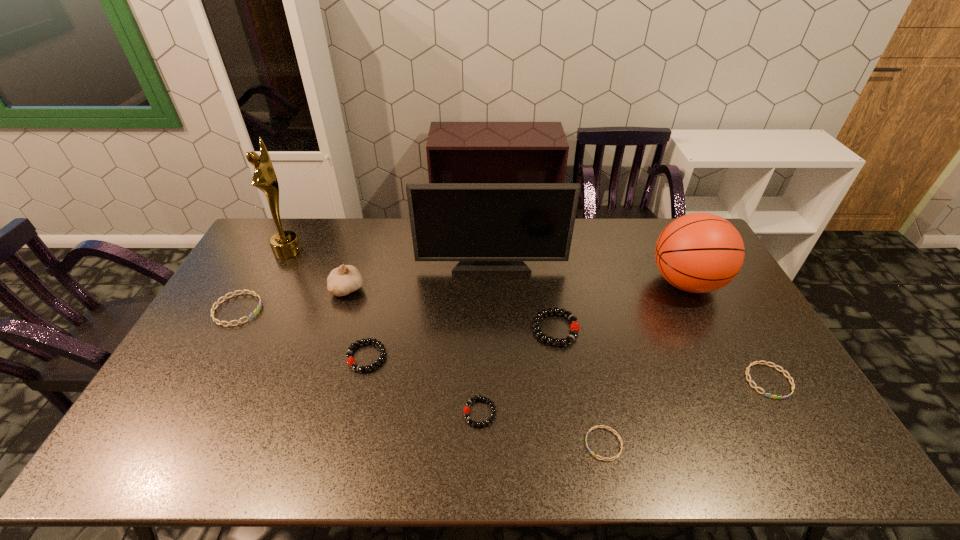
The image size is (960, 540). I want to click on award, so click(285, 244).

Locate an element on the screen. monitor is located at coordinates (490, 228).

Where is `the second tallest object`? the second tallest object is located at coordinates (490, 228).

Image resolution: width=960 pixels, height=540 pixels. Identify the location of the third tallest object. (700, 252).

Identify the location of basketball. The height and width of the screenshot is (540, 960). (700, 252).

At what (x,y) coordinates should I click in order to perform the action: click on the fourth tallest object. Please return your answer as a coordinate pair (x, y). Image resolution: width=960 pixels, height=540 pixels. Looking at the image, I should click on (345, 279).

Identify the location of the eighth object from right to left. The width and height of the screenshot is (960, 540). (345, 279).

You are a GUI agent. You are given a task and a screenshot of the screen. Output one action in this format:
    pyautogui.click(x=<x>, y=<y>)
    Task: Click on the biggest black bracelet
    The height and width of the screenshot is (540, 960).
    Given the screenshot: What is the action you would take?
    pyautogui.click(x=573, y=319)

This screenshot has width=960, height=540. I want to click on the leftmost bracelet, so click(x=251, y=315).

Image resolution: width=960 pixels, height=540 pixels. I want to click on the leftmost blue bracelet, so click(251, 315).